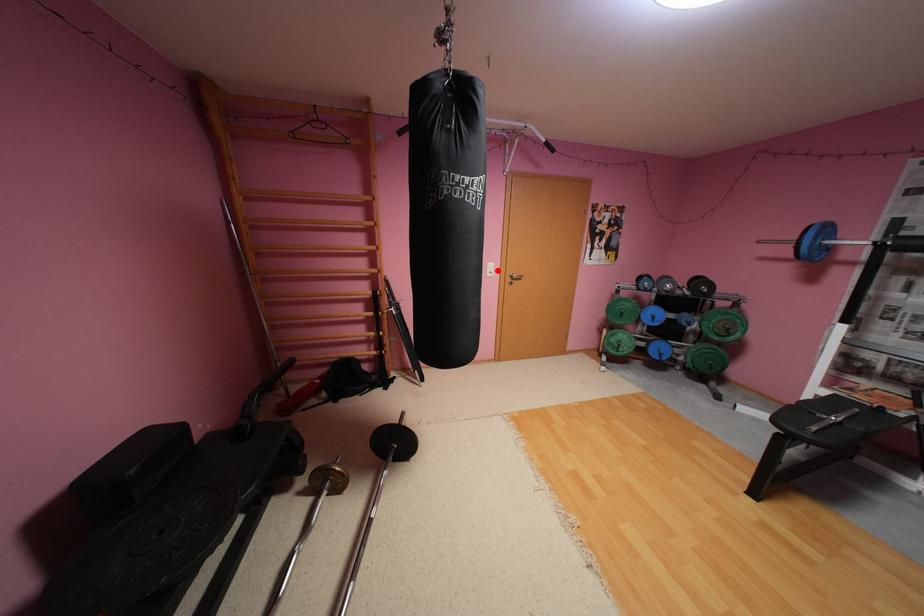
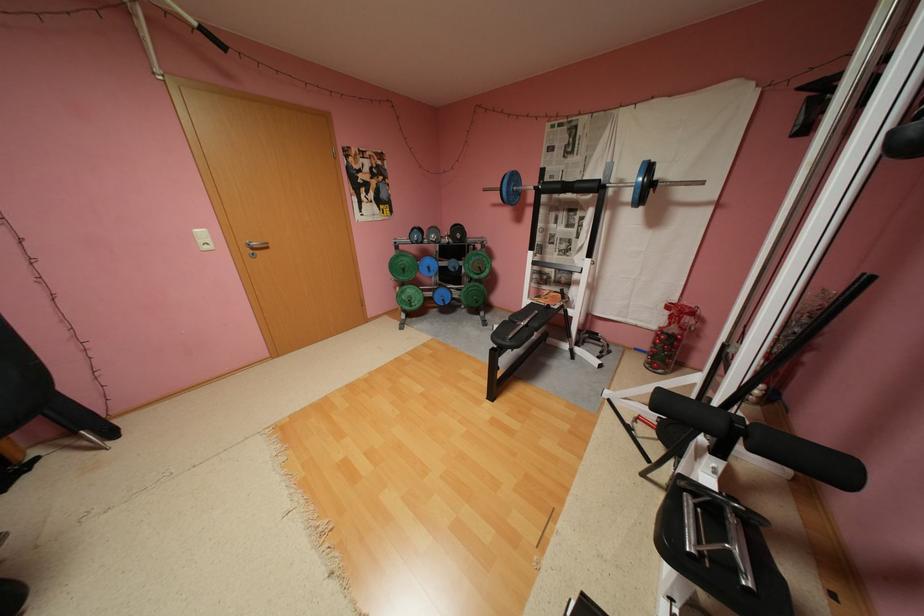
Where in the second image is the point corresponding to the highlighted location from the first image?

(210, 241)